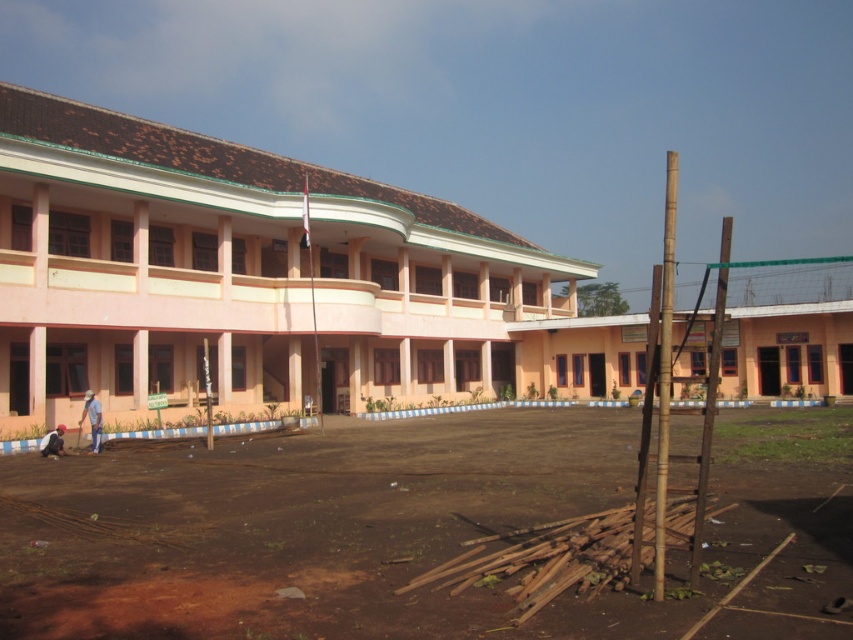
You are planning to place a small garden shed that requires a space of 2 meters by 2 meters. Given the brown dirt field at center and light brown straw hat at lower left, which area would be suitable for placing the shed?

The brown dirt field at center is larger in size than the light brown straw hat at lower left, so the brown dirt field at center would be suitable for placing the garden shed as it has enough space.

You are standing at the entrance of the building and want to find the light brown straw hat at lower left. Which direction should you look relative to the brown dirt field at center?

The light brown straw hat at lower left is located above the brown dirt field at center, so you should look upward from the brown dirt field at center to find it.